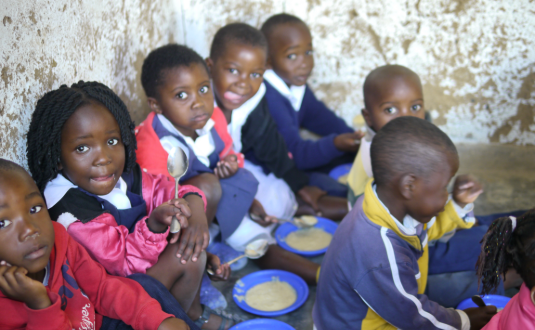
At what (x,y) coordinates should I click in order to perform the action: click on bowls of food. Please return your answer as a coordinate pair (x, y). Looking at the image, I should click on (275, 290), (312, 238), (345, 180), (269, 324), (499, 306).